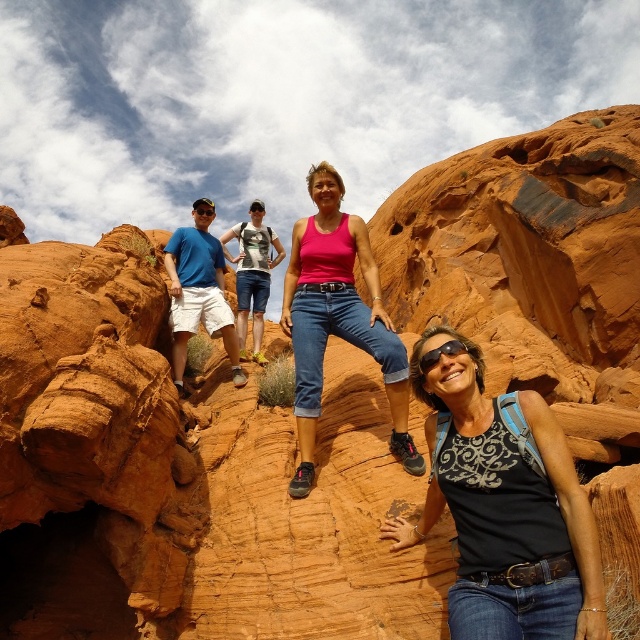
You are a hiker who needs to retrieve the shiny orange goggles at center from the pink fabric tank top at center. Given that you can walk at a speed of 1.5 meters per second, how many seconds will it take you to reach the goggles?

The distance between the pink fabric tank top at center and the shiny orange goggles at center is 26.61 meters. At a walking speed of 1.5 meters per second, it will take approximately 17.74 seconds to reach the goggles.